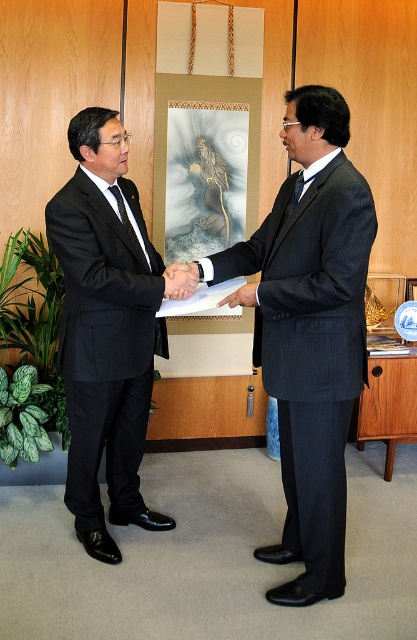
Question: Which object appears closest to the camera in this image?

Choices:
 (A) matte black tie at left
 (B) matte black hand at center

Answer: (B)

Question: Does dark blue pinstripe suit at center have a larger size compared to matte black handshake at center?

Choices:
 (A) no
 (B) yes

Answer: (B)

Question: Which is farther from the dark blue pinstripe suit at center?

Choices:
 (A) matte black tie at left
 (B) matte black hand at center
 (C) matte black suit at left
 (D) matte black handshake at center

Answer: (A)

Question: Considering the real-world distances, which object is closest to the matte black tie at left?

Choices:
 (A) matte black handshake at center
 (B) dark blue pinstripe suit at center

Answer: (A)

Question: Does dark blue pinstripe suit at center appear under matte black suit at left?

Choices:
 (A) yes
 (B) no

Answer: (A)

Question: Can you confirm if dark blue pinstripe suit at center is smaller than matte black handshake at center?

Choices:
 (A) no
 (B) yes

Answer: (A)